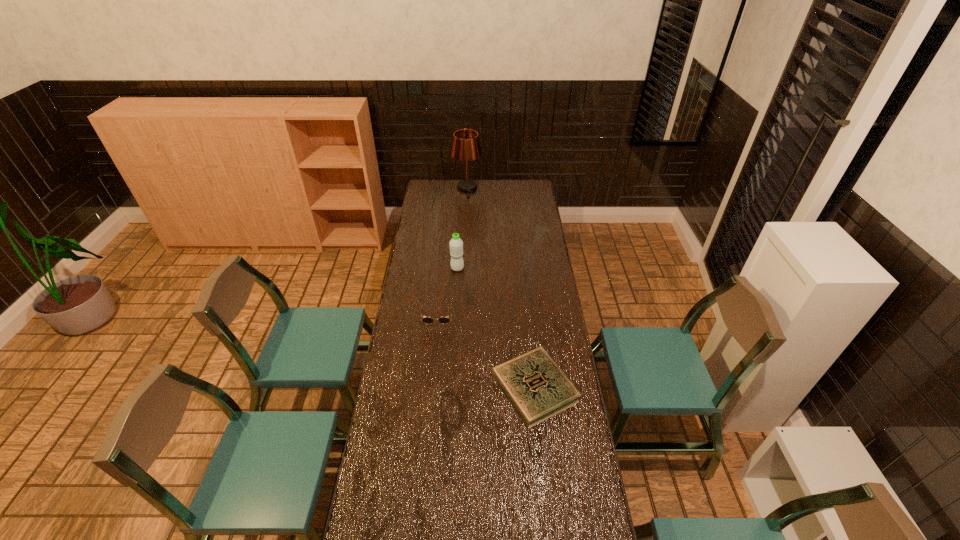
You are a GUI agent. You are given a task and a screenshot of the screen. Output one action in this format:
    pyautogui.click(x=<x>, y=<y>)
    Task: Click on the free space between the shortest object and the sunglasses
    
    Given the screenshot: What is the action you would take?
    pyautogui.click(x=486, y=353)

What are the coordinates of `free space that is in between the sunglasses and the rightmost object` in the screenshot? It's located at (486, 353).

Locate an element on the screen. This screenshot has width=960, height=540. free space between the nearest object and the tallest object is located at coordinates (501, 288).

This screenshot has height=540, width=960. In order to click on empty location between the second tallest object and the lampshade in this screenshot , I will do `click(462, 228)`.

At what (x,y) coordinates should I click in order to perform the action: click on free space between the water bottle and the sunglasses. Please return your answer as a coordinate pair (x, y). Looking at the image, I should click on (447, 293).

You are a GUI agent. You are given a task and a screenshot of the screen. Output one action in this format:
    pyautogui.click(x=<x>, y=<y>)
    Task: Click on the empty location between the second nearest object and the nearest object
    This screenshot has width=960, height=540.
    Given the screenshot: What is the action you would take?
    pyautogui.click(x=486, y=353)

Where is `object that can be found as the third closest to the second tallest object`? This screenshot has height=540, width=960. object that can be found as the third closest to the second tallest object is located at coordinates (466, 146).

This screenshot has height=540, width=960. What are the coordinates of `object that ranks as the second closest to the third farthest object` in the screenshot? It's located at [456, 244].

Find the location of `free space that satisfies the following two spatial constraints: 1. on the front-facing side of the farthest object; 2. on the right side of the shortest object`. free space that satisfies the following two spatial constraints: 1. on the front-facing side of the farthest object; 2. on the right side of the shortest object is located at coordinates (459, 388).

Locate an element on the screen. This screenshot has height=540, width=960. blank space that satisfies the following two spatial constraints: 1. on the front side of the third nearest object; 2. on the left side of the shortest object is located at coordinates (450, 388).